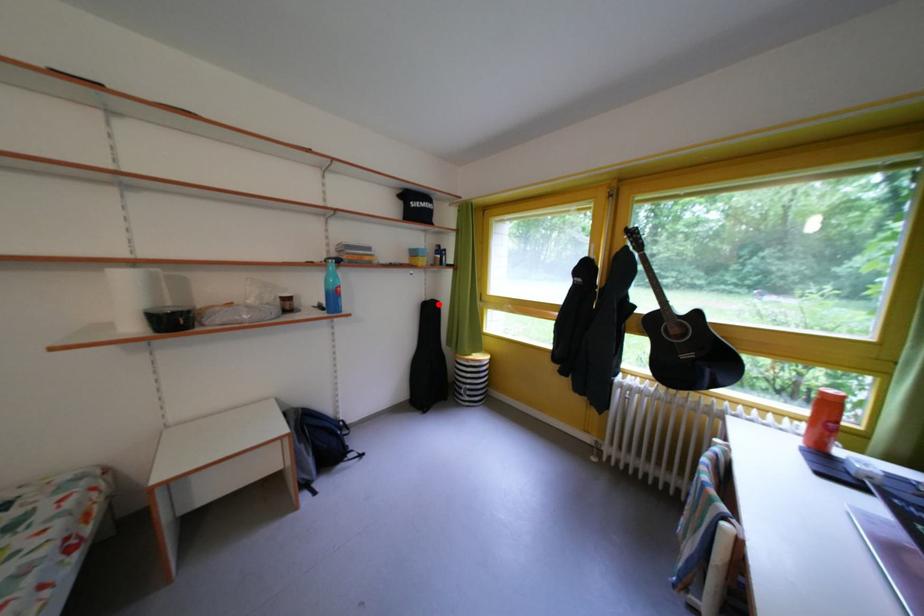
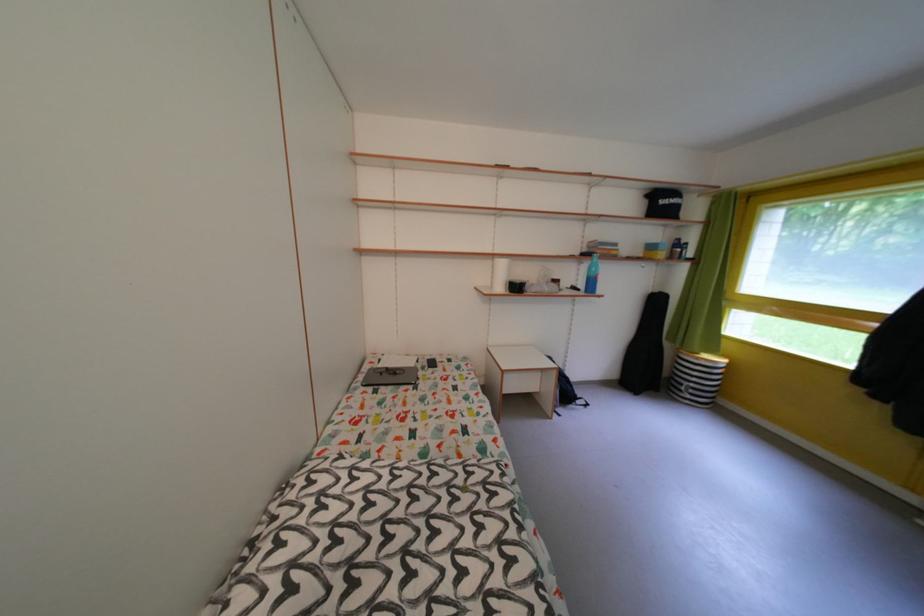
Question: I am providing you with two images of the same scene from different viewpoints. A red point is shown in image1. For the corresponding object point in image2, is it positioned nearer or farther from the camera?

Choices:
 (A) Nearer
 (B) Farther

Answer: (B)